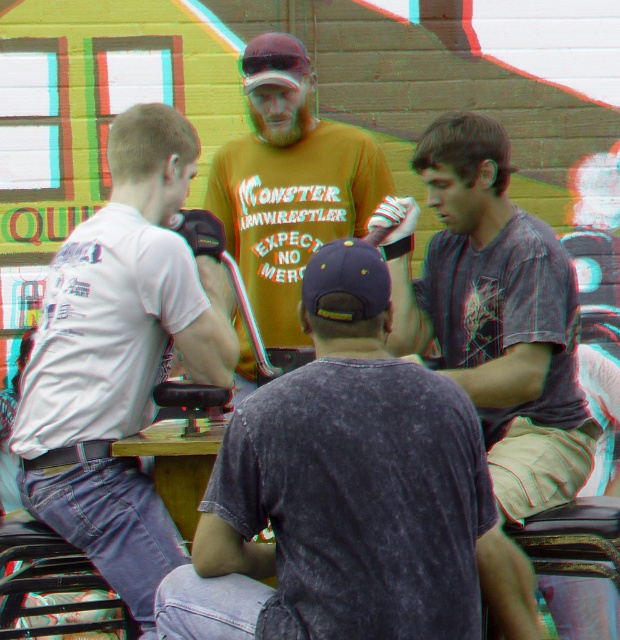
Consider the image. Between dark gray speckled shirt at center and dark gray striped shirt at center, which one is positioned higher?

dark gray striped shirt at center is above.

Locate an element on the screen. Image resolution: width=620 pixels, height=640 pixels. dark gray speckled shirt at center is located at coordinates (347, 492).

Locate an element on the screen. The height and width of the screenshot is (640, 620). dark gray speckled shirt at center is located at coordinates (347, 492).

Between white matte t-shirt at left and matte purple baseball cap at center, which one has more height?

white matte t-shirt at left

Identify the location of white matte t-shirt at left. This screenshot has width=620, height=640. (120, 356).

Is point (148, 193) more distant than point (352, 314)?

Yes, it is behind point (352, 314).

I want to click on white matte t-shirt at left, so click(120, 356).

Who is more forward, (459, 317) or (366, 316)?

Positioned in front is point (366, 316).

Is point (451, 246) less distant than point (339, 260)?

That is False.

This screenshot has width=620, height=640. In order to click on dark gray striped shirt at center in this screenshot , I will do `click(494, 312)`.

Find the location of a particular element. This screenshot has height=640, width=620. dark gray striped shirt at center is located at coordinates (494, 312).